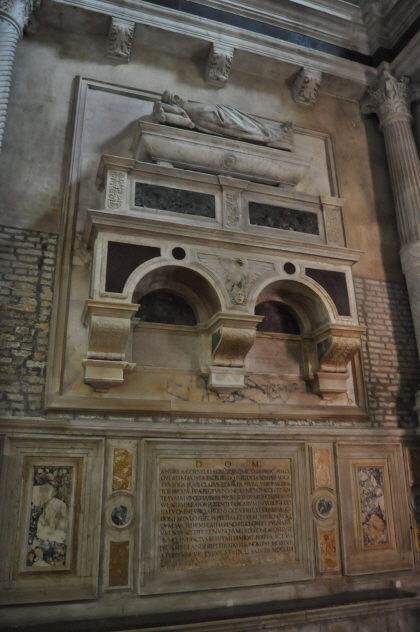
Identify the location of pillar on wall. (393, 124), (4, 47).